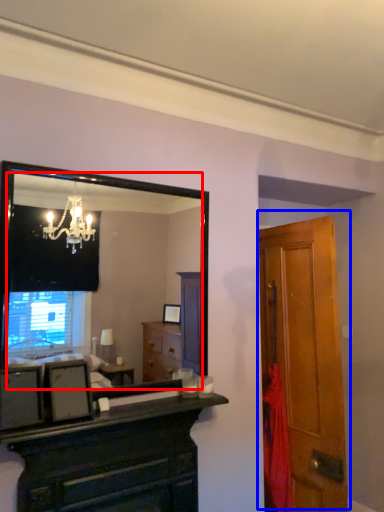
Question: Which of the following is the farthest to the observer, mirror (highlighted by a red box) or door (highlighted by a blue box)?

Choices:
 (A) mirror
 (B) door

Answer: (B)